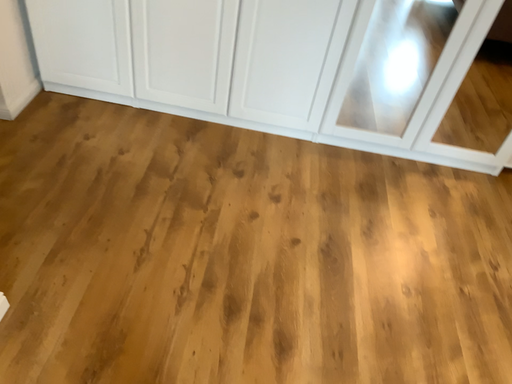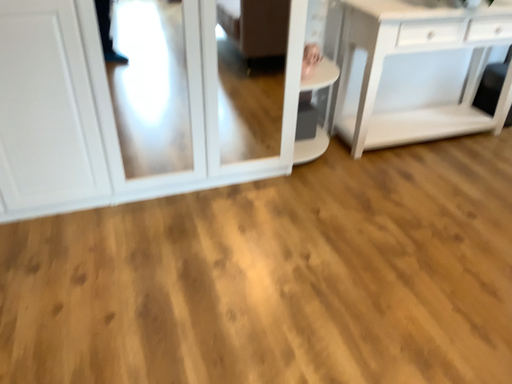
Question: How did the camera likely rotate when shooting the video?

Choices:
 (A) rotated left
 (B) rotated right

Answer: (B)